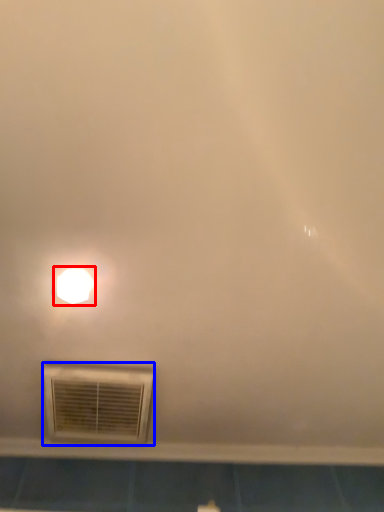
Question: Which of the following is the farthest to the observer, lamp (highlighted by a red box) or air conditioning (highlighted by a blue box)?

Choices:
 (A) lamp
 (B) air conditioning

Answer: (B)